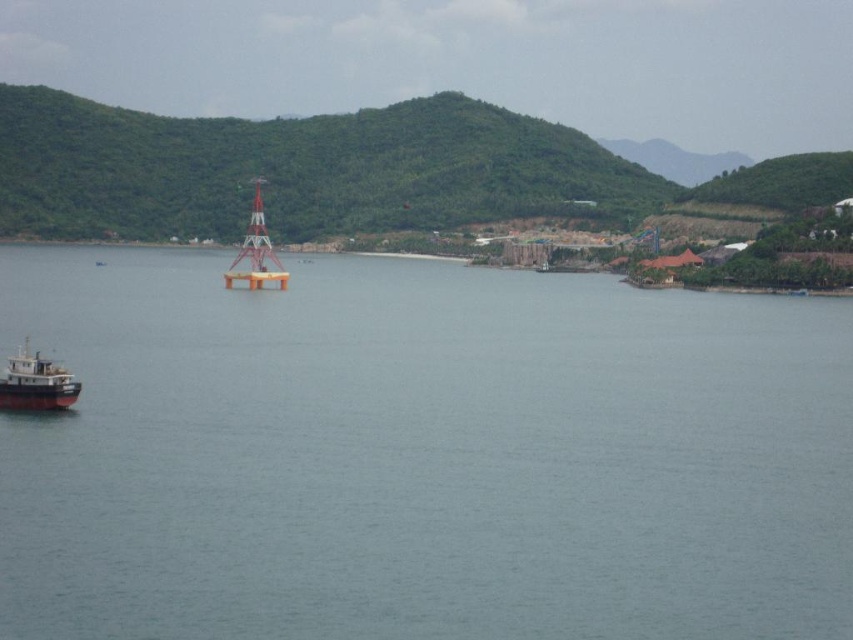
Who is lower down, transparent water at center or brown matte boat at lower left?

brown matte boat at lower left is below.

Is point (560, 509) closer to viewer compared to point (35, 365)?

Yes, it is.

Describe the element at coordinates (421, 456) in the screenshot. The image size is (853, 640). I see `transparent water at center` at that location.

Where is `transparent water at center`? This screenshot has width=853, height=640. transparent water at center is located at coordinates (421, 456).